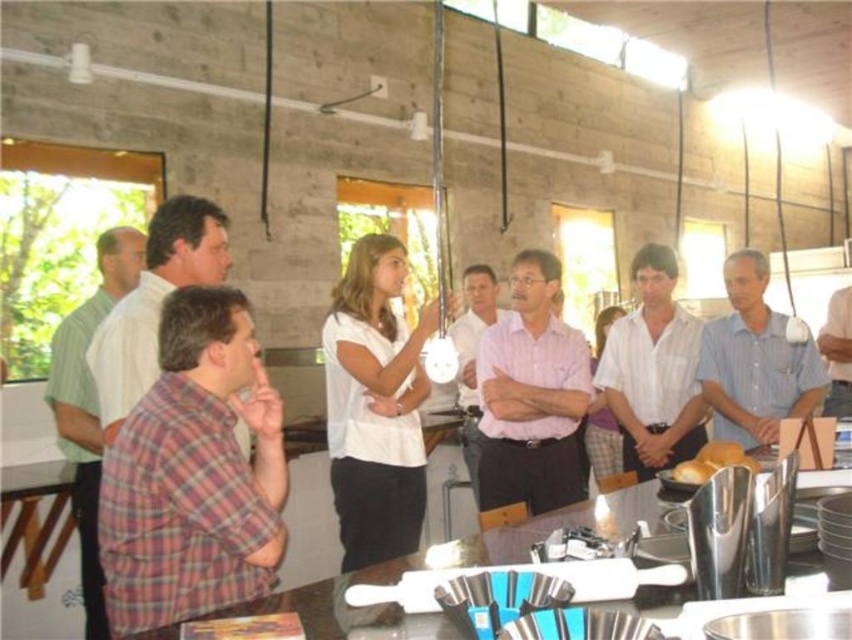
You are organizing a photo shoot and need to determine the best camera angle to capture both the light blue shirt at center and the plaid shirt at left without cropping either. Based on their widths, which shirt should be placed closer to the camera to ensure both fit within the frame?

The light blue shirt at center is wider than the plaid shirt at left. To ensure both fit within the frame, the plaid shirt at left should be placed closer to the camera since its narrower width requires less space compared to the wider light blue shirt at center.

You are organizing a photo shoot and need to place two shirts in the scene for a catalog. The light blue shirt at center and the plaid shirt at left must be positioned based on their sizes. Which shirt should you place on a shelf that can only hold larger items?

The light blue shirt at center has a larger size compared to plaid shirt at left, so you should place the light blue shirt at center on the shelf that can only hold larger items.

Based on the photo, you are standing in the room and want to see the entire table surface. Which person, the plaid cotton shirt at lower left or the light blue shirt at center, is closer to the table?

The plaid cotton shirt at lower left is closer to the table than the light blue shirt at center because it is shorter and can bend down more easily to see the table surface.